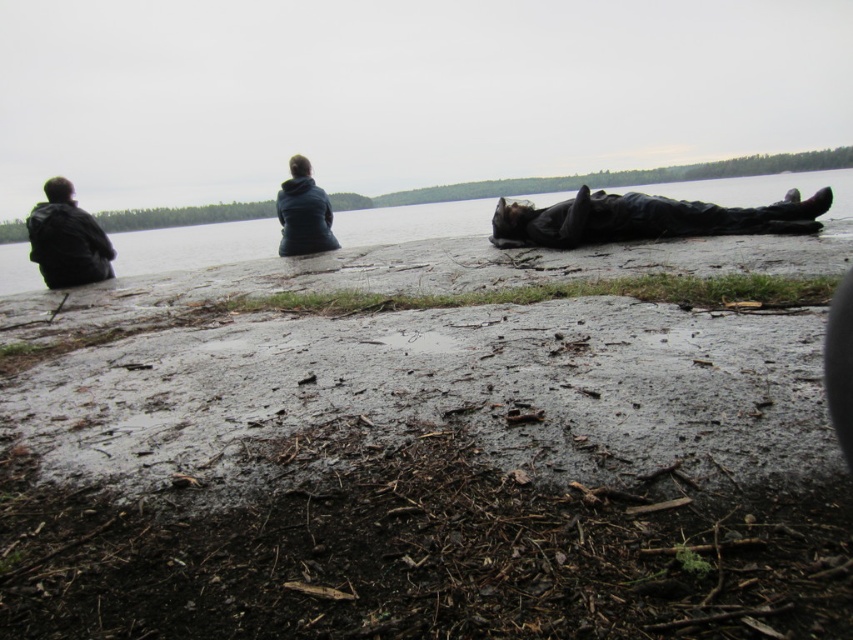
Question: Considering the real-world distances, which object is closest to the matte black jacket at left?

Choices:
 (A) matte blue jacket at upper center
 (B) clear water at center
 (C) black matte body at center

Answer: (A)

Question: Where is clear water at center located in relation to black matte body at center in the image?

Choices:
 (A) below
 (B) above

Answer: (A)

Question: Can you confirm if clear water at center is positioned to the left of matte blue jacket at upper center?

Choices:
 (A) no
 (B) yes

Answer: (A)

Question: Which object appears farthest from the camera in this image?

Choices:
 (A) matte black jacket at left
 (B) matte blue jacket at upper center

Answer: (B)

Question: Which object appears closest to the camera in this image?

Choices:
 (A) matte black jacket at left
 (B) black matte body at center
 (C) matte blue jacket at upper center

Answer: (B)

Question: In this image, where is black matte body at center located relative to matte blue jacket at upper center?

Choices:
 (A) below
 (B) above

Answer: (A)